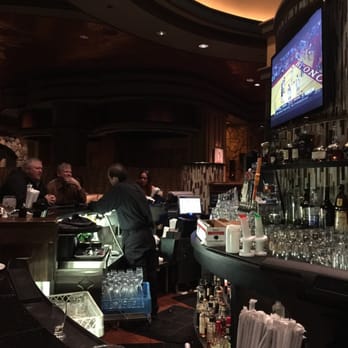
Where is `glassware`? The height and width of the screenshot is (348, 348). glassware is located at coordinates (125, 297).